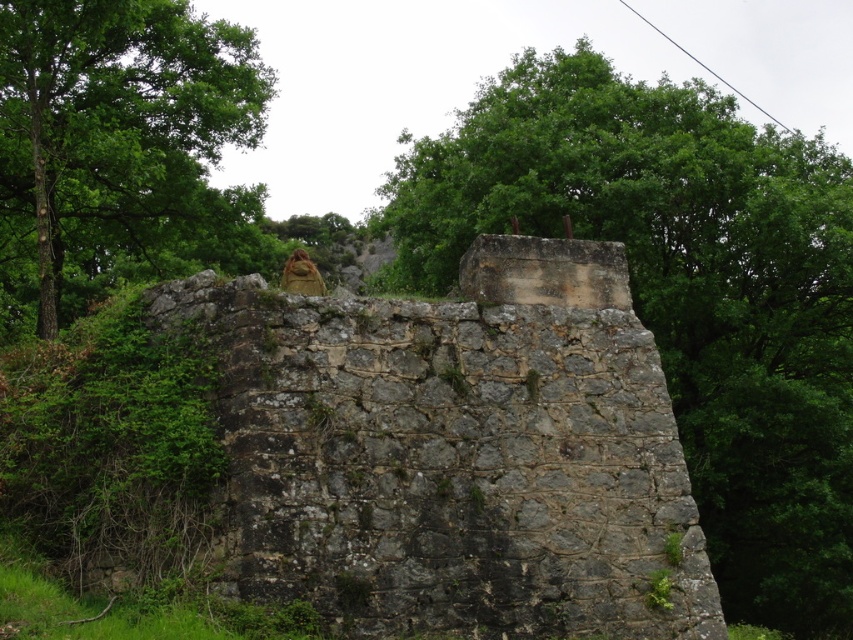
Is green leafy tree at upper center shorter than green leafy tree at upper left?

Incorrect, green leafy tree at upper center's height does not fall short of green leafy tree at upper left's.

Is green leafy tree at upper center closer to camera compared to green leafy tree at upper left?

Yes.

Who is more distant from viewer, (830, 593) or (141, 116)?

The point (141, 116) is more distant.

Locate an element on the screen. This screenshot has height=640, width=853. green leafy tree at upper center is located at coordinates (682, 291).